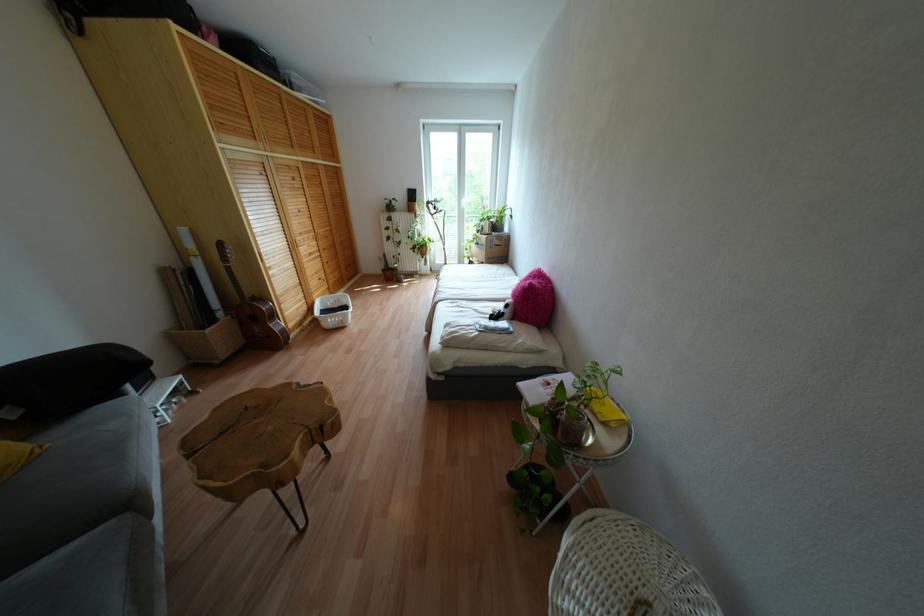
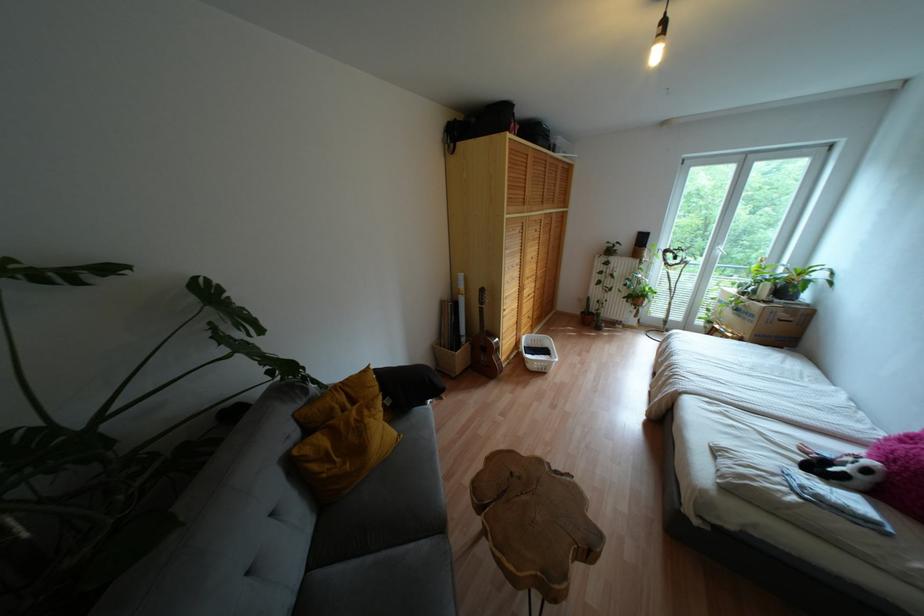
Locate, in the second image, the point that corresponds to point (464, 201) in the first image.

(723, 248)